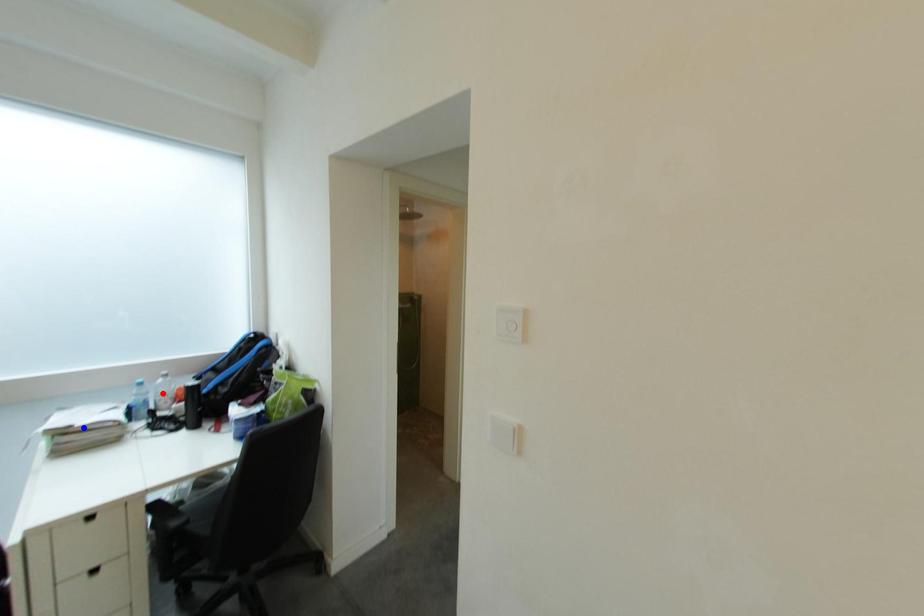
Question: In the image, two points are highlighted. Which point is nearer to the camera? Reply with the corresponding letter.

Choices:
 (A) blue point
 (B) red point

Answer: (A)